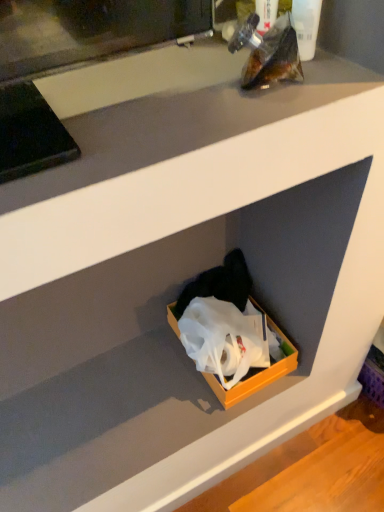
Locate an element on the screen. The image size is (384, 512). vacant space positioned to the left of orange matte box at lower center is located at coordinates (139, 381).